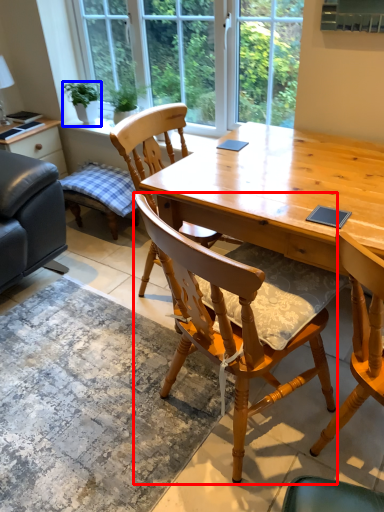
Question: Which object is further to the camera taking this photo, chair (highlighted by a red box) or houseplant (highlighted by a blue box)?

Choices:
 (A) chair
 (B) houseplant

Answer: (B)